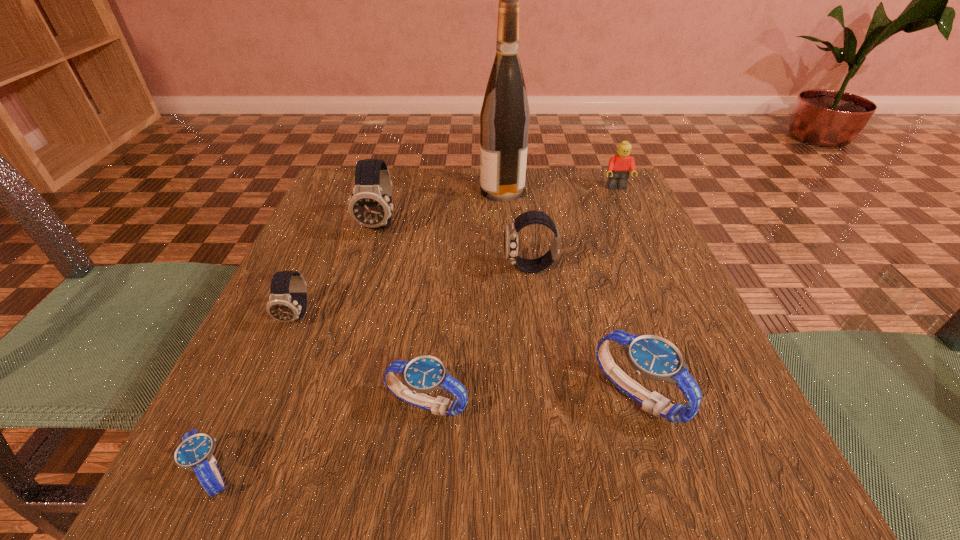
Where is `the tallest object`? the tallest object is located at coordinates (504, 119).

Identify the location of the fourth watch from right to left. (370, 205).

Where is `the second dark watch from left to right`? the second dark watch from left to right is located at coordinates (370, 205).

Locate an element on the screen. The height and width of the screenshot is (540, 960). the second biggest dark watch is located at coordinates (511, 231).

Where is `the fifth shortest watch`? This screenshot has height=540, width=960. the fifth shortest watch is located at coordinates (511, 231).

Where is `the rightmost object`? This screenshot has width=960, height=540. the rightmost object is located at coordinates (620, 165).

You are a GUI agent. You are given a task and a screenshot of the screen. Output one action in this format:
    pyautogui.click(x=<x>, y=<y>)
    Task: Click on the rightmost watch
    
    Given the screenshot: What is the action you would take?
    pyautogui.click(x=653, y=357)

Locate an element on the screen. the biggest blue watch is located at coordinates click(653, 357).

The height and width of the screenshot is (540, 960). Identify the location of the fifth farthest object. (282, 306).

At what (x,y) coordinates should I click in order to perform the action: click on the third farthest watch. Please return your answer as a coordinate pair (x, y). This screenshot has height=540, width=960. Looking at the image, I should click on (282, 306).